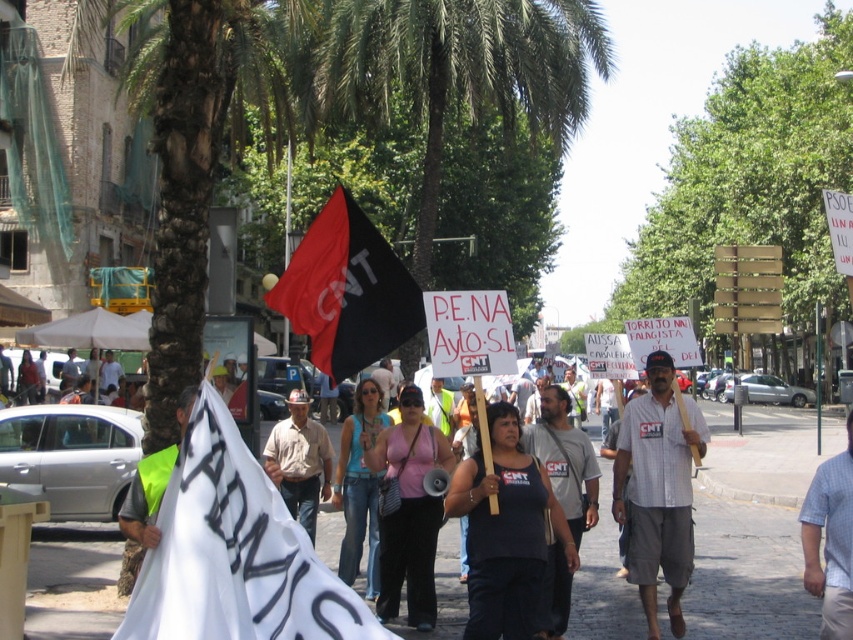
Question: Can you confirm if green leafy palm tree at center is positioned below pink fabric tank top at center?

Choices:
 (A) yes
 (B) no

Answer: (B)

Question: Is green leafy palm tree at center above denim jeans at center?

Choices:
 (A) yes
 (B) no

Answer: (A)

Question: Which object is the farthest from the black cotton tank top at center?

Choices:
 (A) light blue checkered shirt at center
 (B) white cotton shirt at center

Answer: (A)

Question: Which of the following is the closest to the observer?

Choices:
 (A) (840, 467)
 (B) (311, 474)

Answer: (A)

Question: Considering the real-world distances, which object is closest to the green leafy palm tree at center?

Choices:
 (A) black cotton tank top at center
 (B) light blue checkered shirt at center
 (C) black matte flag at center
 (D) white cotton shirt at center

Answer: (B)

Question: Does denim jeans at center have a smaller size compared to brown cotton shirt at center?

Choices:
 (A) yes
 (B) no

Answer: (B)